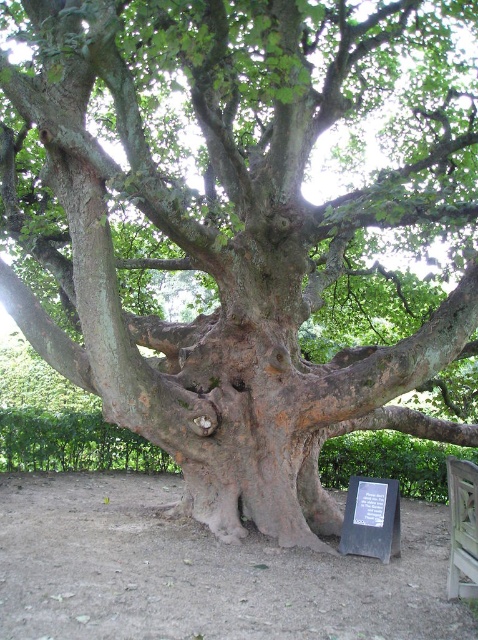
Question: Which object is closer to the camera taking this photo?

Choices:
 (A) black stone plaque at lower center
 (B) wooden bench at lower right

Answer: (B)

Question: From the image, what is the correct spatial relationship of black stone plaque at lower center in relation to wooden bench at lower right?

Choices:
 (A) right
 (B) left

Answer: (B)

Question: Which point is closer to the camera?

Choices:
 (A) black stone plaque at lower center
 (B) wooden bench at lower right

Answer: (B)

Question: Among these objects, which one is nearest to the camera?

Choices:
 (A) black stone plaque at lower center
 (B) wooden bench at lower right

Answer: (B)

Question: Can you confirm if black stone plaque at lower center is smaller than wooden bench at lower right?

Choices:
 (A) no
 (B) yes

Answer: (A)

Question: Is black stone plaque at lower center closer to the viewer compared to wooden bench at lower right?

Choices:
 (A) yes
 (B) no

Answer: (B)